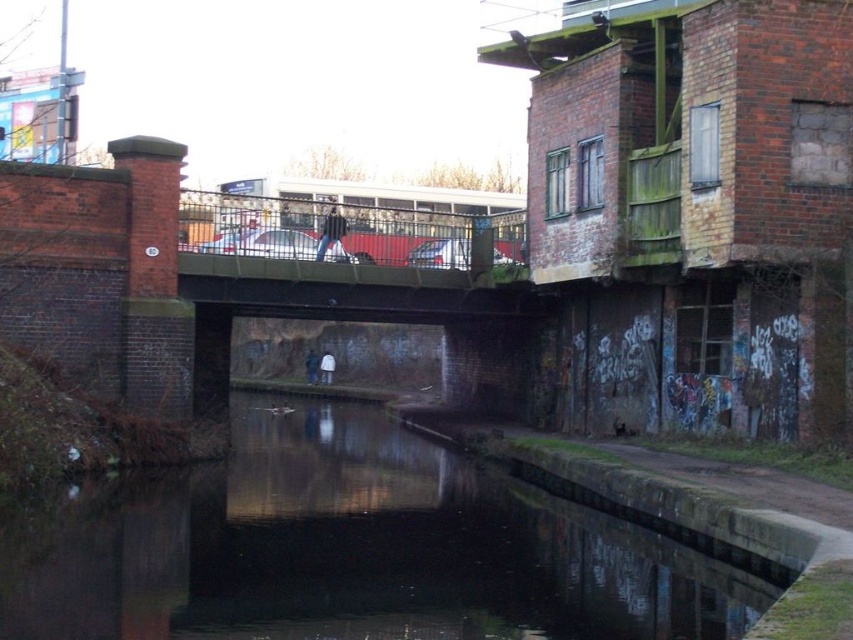
Which is in front, point (318, 253) or point (311, 372)?

Point (318, 253) is in front.

Who is positioned more to the right, striped fabric person at center or dark blue jeans at center?

striped fabric person at center

What are the coordinates of `striped fabric person at center` in the screenshot? It's located at (329, 230).

Which is behind, point (331, 220) or point (329, 364)?

The point (329, 364) is behind.

What do you see at coordinates (329, 230) in the screenshot? The image size is (853, 640). I see `striped fabric person at center` at bounding box center [329, 230].

This screenshot has height=640, width=853. Identify the location of striped fabric person at center. (329, 230).

Consider the image. Is dark concrete water at center bigger than striped fabric person at center?

Yes.

Does dark concrete water at center appear on the right side of striped fabric person at center?

Indeed, dark concrete water at center is positioned on the right side of striped fabric person at center.

Measure the distance between dark concrete water at center and camera.

The distance of dark concrete water at center from camera is 29.74 feet.

Locate an element on the screen. This screenshot has height=640, width=853. dark concrete water at center is located at coordinates (349, 548).